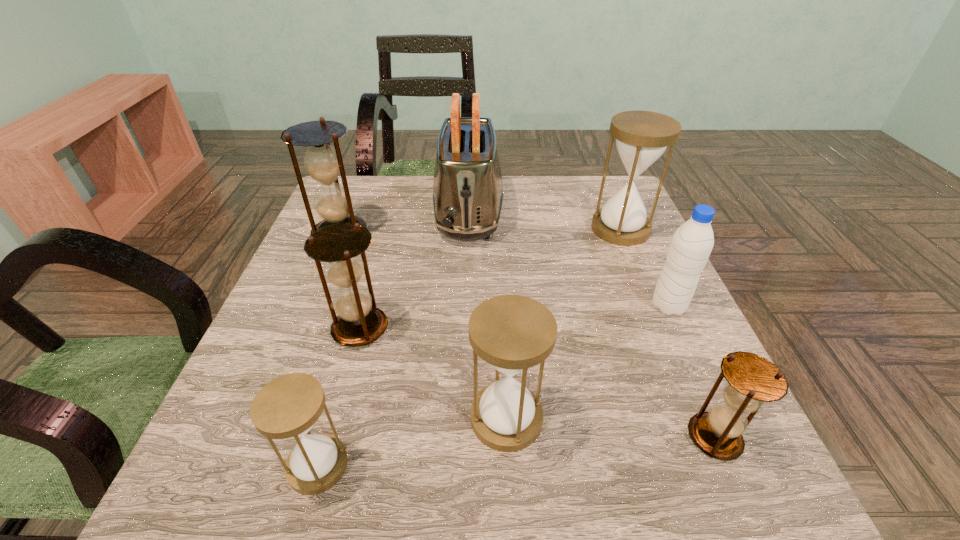
Where is `toaster that is at the far edge`? This screenshot has width=960, height=540. toaster that is at the far edge is located at coordinates (467, 195).

Find the location of a particular element. This screenshot has height=540, width=960. water bottle located in the right edge section of the desktop is located at coordinates (691, 245).

Identify the location of object that is at the far left corner. (323, 163).

You are a GUI agent. You are given a task and a screenshot of the screen. Output one action in this format:
    pyautogui.click(x=<x>, y=<y>)
    Task: Click on the object located at the near left corner
    
    Given the screenshot: What is the action you would take?
    pyautogui.click(x=287, y=407)

The width and height of the screenshot is (960, 540). I want to click on object positioned at the far right corner, so click(642, 137).

What are the coordinates of `object that is at the near right corner` in the screenshot? It's located at (752, 380).

In the image, there is a desktop. Where is `vacant space at the far edge`? vacant space at the far edge is located at coordinates 547,199.

Where is `vacant space at the near edge`? The image size is (960, 540). vacant space at the near edge is located at coordinates (535, 507).

The width and height of the screenshot is (960, 540). Identify the location of free spot at the left edge of the desktop. (313, 323).

Identify the location of vacant space at the right edge of the desktop. (651, 267).